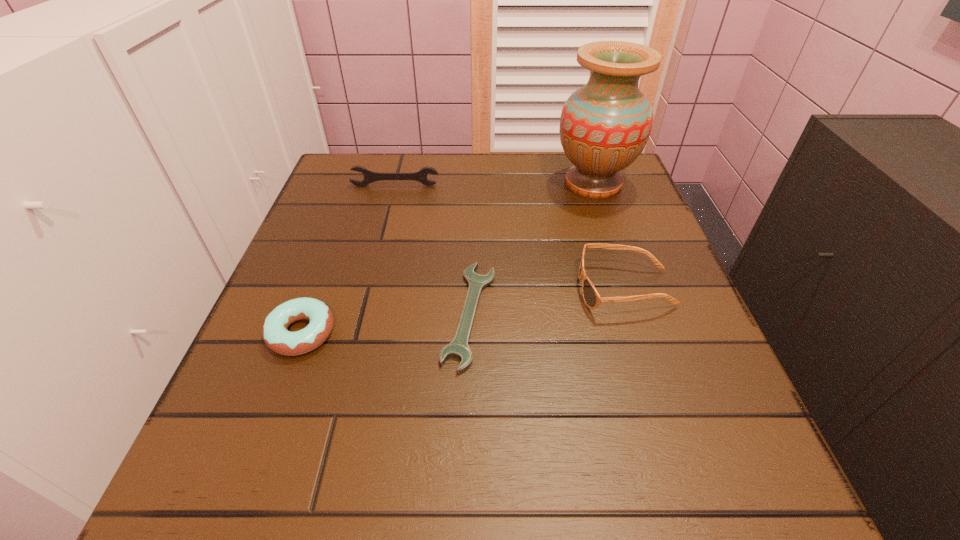
Image resolution: width=960 pixels, height=540 pixels. What are the coordinates of `vase` in the screenshot? It's located at (604, 126).

This screenshot has height=540, width=960. Identify the location of sunglasses. (592, 299).

Where is `the taller wrench`? the taller wrench is located at coordinates (370, 176).

Identify the location of the left wrench. (370, 176).

Identify the location of doughnut. The width and height of the screenshot is (960, 540). (276, 336).

You are a GUI agent. You are given a task and a screenshot of the screen. Output one action in this format:
    pyautogui.click(x=<x>, y=<y>)
    Task: Click on the shortest object
    
    Given the screenshot: What is the action you would take?
    pyautogui.click(x=458, y=348)

I want to click on the shorter wrench, so click(x=458, y=348).

Where is `vacant space situated 0.150m on the front of the tallest object`? vacant space situated 0.150m on the front of the tallest object is located at coordinates (615, 250).

Where is `vacant region located 0.380m on the front-facing side of the sunglasses`? This screenshot has width=960, height=540. vacant region located 0.380m on the front-facing side of the sunglasses is located at coordinates (373, 289).

I want to click on free space located 0.270m on the front-facing side of the sunglasses, so click(433, 289).